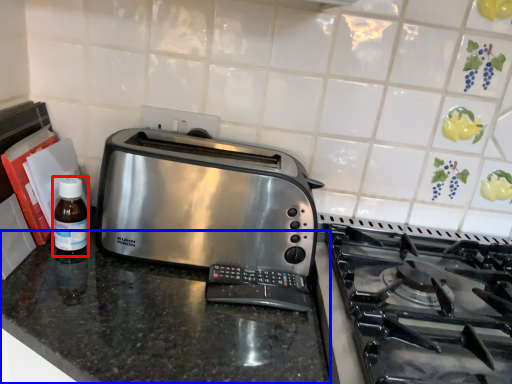
Question: Which object is further to the camera taking this photo, bottle (highlighted by a red box) or counter (highlighted by a blue box)?

Choices:
 (A) bottle
 (B) counter

Answer: (A)